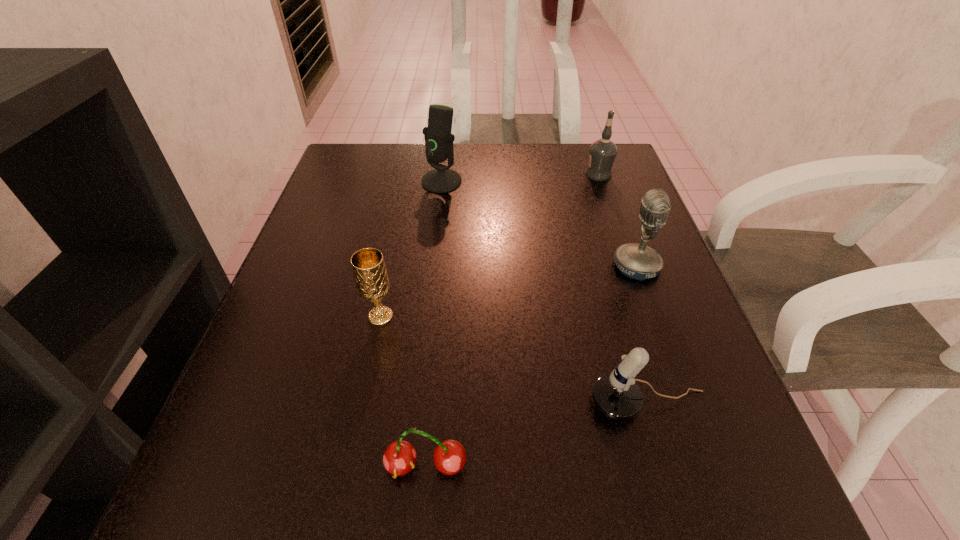
The image size is (960, 540). What are the coordinates of `the leftmost microphone` in the screenshot? It's located at (439, 141).

Where is `the third farthest object`? the third farthest object is located at coordinates (637, 261).

This screenshot has height=540, width=960. What are the coordinates of `vodka` in the screenshot? It's located at (603, 151).

Identify the location of the leftmost object. (371, 279).

Locate an element on the screen. This screenshot has width=960, height=540. the fourth farthest object is located at coordinates (371, 279).

The height and width of the screenshot is (540, 960). Identify the location of the nearest microphone. [x=616, y=395].

This screenshot has height=540, width=960. What are the coordinates of `the shortest microphone` in the screenshot? It's located at (616, 395).

Locate an element on the screen. the shortest object is located at coordinates (400, 457).

Locate an element on the screen. This screenshot has width=960, height=540. cherry is located at coordinates (400, 457).

This screenshot has width=960, height=540. I want to click on free space located 0.050m on the back of the farthest microphone, so click(444, 160).